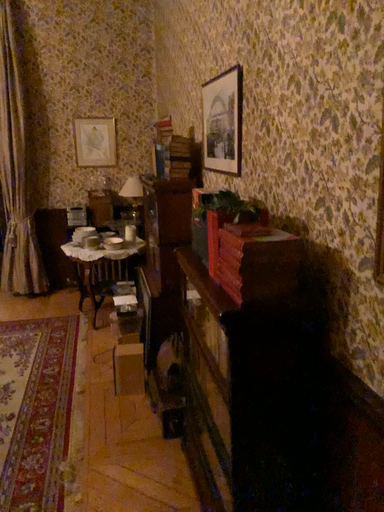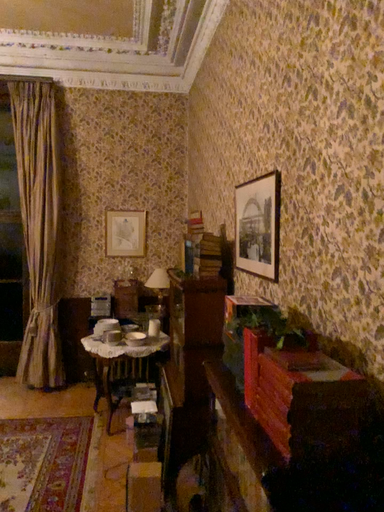
Question: Which way did the camera rotate in the video?

Choices:
 (A) rotated upward
 (B) rotated downward

Answer: (A)